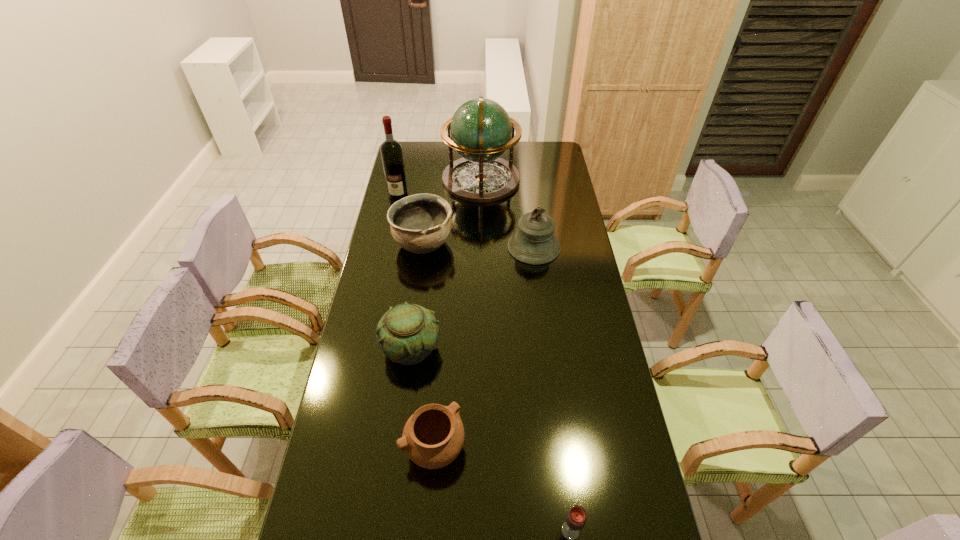
Identify which object is the third nearest to the nearest object. Please provide its 2D coordinates. Your answer should be formatted as a tuple, i.e. [(x, y)], where the tuple contains the x and y coordinates of a point satisfying the conditions above.

[(534, 243)]

Select which pottery appears as the second closest to the nearest pottery. Please provide its 2D coordinates. Your answer should be formatted as a tuple, i.e. [(x, y)], where the tuple contains the x and y coordinates of a point satisfying the conditions above.

[(421, 223)]

Locate which pottery is the closest to the second farthest pottery. Please provide its 2D coordinates. Your answer should be formatted as a tuple, i.e. [(x, y)], where the tuple contains the x and y coordinates of a point satisfying the conditions above.

[(433, 437)]

Locate an element on the screen. This screenshot has height=540, width=960. free space that satisfies the following two spatial constraints: 1. on the front and back of the shortest pottery; 2. on the left side of the alcohol is located at coordinates (344, 448).

Where is `vacant space that satisfies the following two spatial constraints: 1. on the front-facing side of the globe; 2. on the front and back of the alcohol`? vacant space that satisfies the following two spatial constraints: 1. on the front-facing side of the globe; 2. on the front and back of the alcohol is located at coordinates (481, 195).

Where is `vacant region that satisfies the following two spatial constraints: 1. on the front and back of the alcohol; 2. on the right side of the fifth farthest object`? The image size is (960, 540). vacant region that satisfies the following two spatial constraints: 1. on the front and back of the alcohol; 2. on the right side of the fifth farthest object is located at coordinates (365, 348).

At what (x,y) coordinates should I click in order to perform the action: click on free space that satisfies the following two spatial constraints: 1. on the front and back of the farthest pottery; 2. on the right side of the alcohol. Please return your answer as a coordinate pair (x, y). The height and width of the screenshot is (540, 960). Looking at the image, I should click on (388, 244).

You are a GUI agent. You are given a task and a screenshot of the screen. Output one action in this format:
    pyautogui.click(x=<x>, y=<y>)
    Task: Click on the free space that satisfies the following two spatial constraints: 1. on the back side of the fifth shortest object; 2. on the left side of the fifth farthest object
    Image resolution: width=960 pixels, height=540 pixels.
    Given the screenshot: What is the action you would take?
    pyautogui.click(x=424, y=247)

This screenshot has height=540, width=960. I want to click on free region that satisfies the following two spatial constraints: 1. on the front and back of the sixth farthest object; 2. on the left side of the alcohol, so click(344, 448).